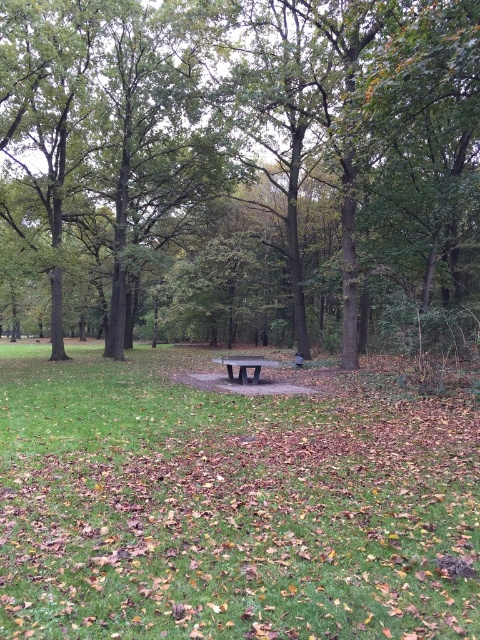
Question: Which point is farther from the camera taking this photo?

Choices:
 (A) (58, 628)
 (B) (274, 362)
 (C) (220, 164)

Answer: (C)

Question: Can you confirm if brown wood bench at center is smaller than wooden bench at center?

Choices:
 (A) yes
 (B) no

Answer: (B)

Question: Considering the relative positions of brown wood bench at center and wooden bench at center in the image provided, where is brown wood bench at center located with respect to wooden bench at center?

Choices:
 (A) below
 (B) above

Answer: (B)

Question: Where is brown wood bench at center located in relation to dark gray polished bench at center in the image?

Choices:
 (A) below
 (B) above

Answer: (B)

Question: Which is farther from the wooden bench at center?

Choices:
 (A) dark gray polished bench at center
 (B) brown wood bench at center

Answer: (B)

Question: Which of the following is the farthest from the observer?

Choices:
 (A) (338, 252)
 (B) (200, 429)

Answer: (A)